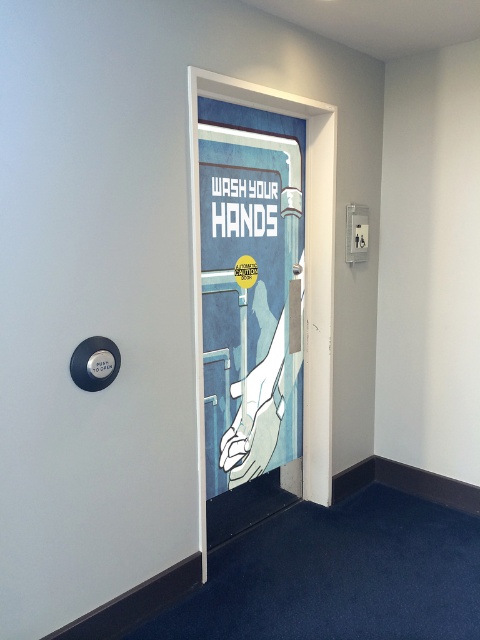
You are a delivery person trying to enter the restroom. You see the white glossy door at center and the blue paper poster at center. Which object is taller?

The white glossy door at center is much taller than the blue paper poster at center.

You are a delivery person trying to enter the restroom. You see the white glossy door at center and the blue paper poster at center. Which one is bigger in size?

The white glossy door at center is larger in size compared to the blue paper poster at center.

You are standing 2 meters away from the door and want to reach the restroom. There is a point at coordinates point (104, 212). Can you safely approach the door without stepping on that point?

The distance of point (104, 212) from viewer is 1.99 meters. Since you are standing 2 meters away from the door, the point is very close to your current position. Therefore, you need to be cautious to avoid stepping on it as you move forward.